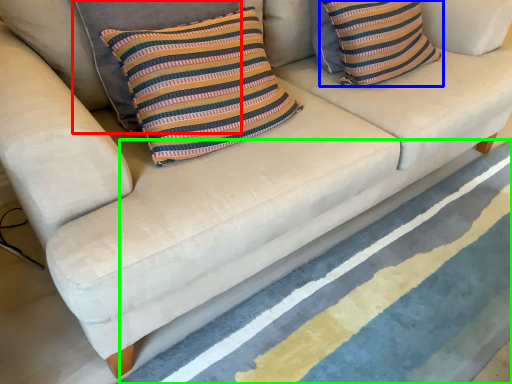
Question: Estimate the real-world distances between objects in this image. Which object is closer to pillow (highlighted by a red box), pillow (highlighted by a blue box) or stripe (highlighted by a green box)?

Choices:
 (A) pillow
 (B) stripe

Answer: (A)